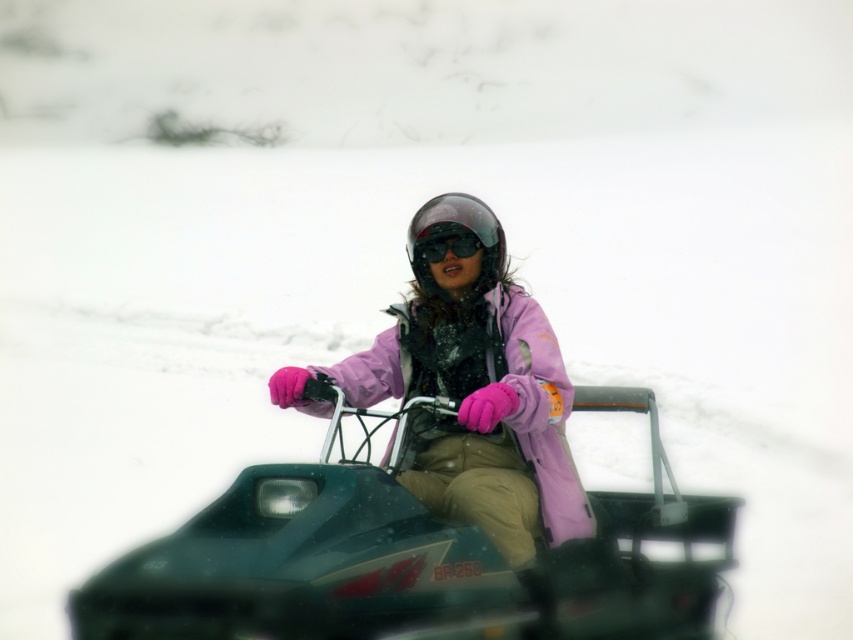
You are a photographer trying to capture a closeup shot of the pink matte jacket at center and the black matte goggles at center. Which object should you zoom in more on to ensure both are clearly visible in the photo?

The pink matte jacket at center is bigger than the black matte goggles at center, so you should zoom in more on the pink matte jacket at center to ensure both are clearly visible in the photo.

You are a winter sports instructor preparing to demonstrate safety gear. You have a transparent plastic helmet at center and black matte goggles at center. Which item would you recommend to a student who needs a larger protective covering for their face?

The transparent plastic helmet at center has a larger size compared to the black matte goggles at center, so it would provide a larger protective covering for the face.

You are a photographer trying to capture a clear shot of the pink matte jacket at center and the transparent plastic helmet at center. Since the snow is falling heavily, you need to know which object is lower to focus your camera first. Which one is positioned lower?

The pink matte jacket at center is below transparent plastic helmet at center, so you should focus on the pink matte jacket at center first as it is lower.